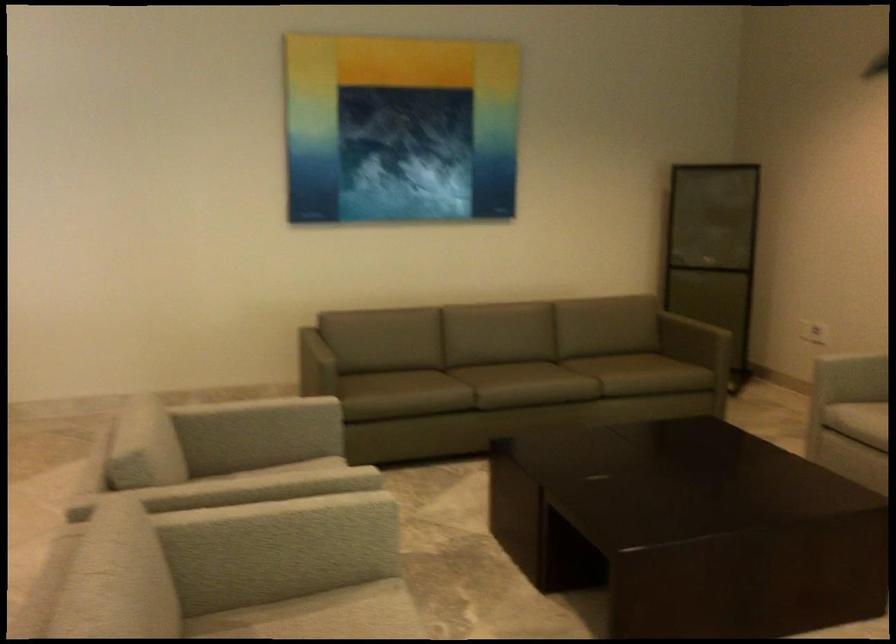
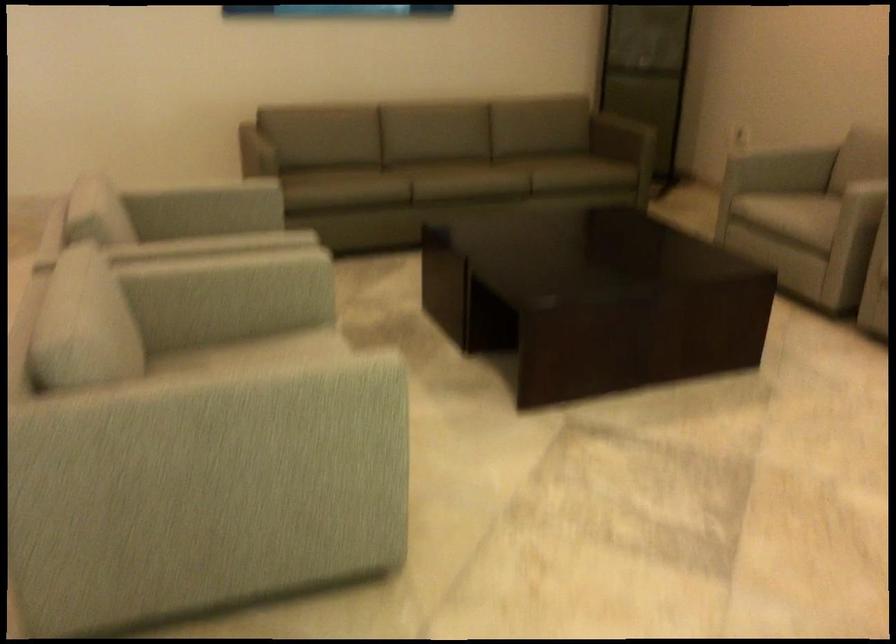
Question: The images are taken continuously from a first-person perspective. In which direction is your viewpoint rotating?

Choices:
 (A) Left
 (B) Right
 (C) Up
 (D) Down

Answer: (D)